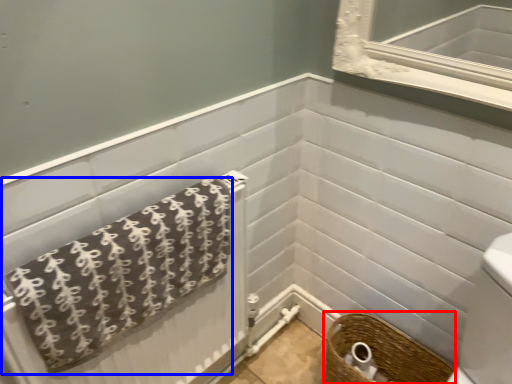
Question: Which of the following is the farthest to the observer, basket (highlighted by a red box) or towel (highlighted by a blue box)?

Choices:
 (A) basket
 (B) towel

Answer: (A)